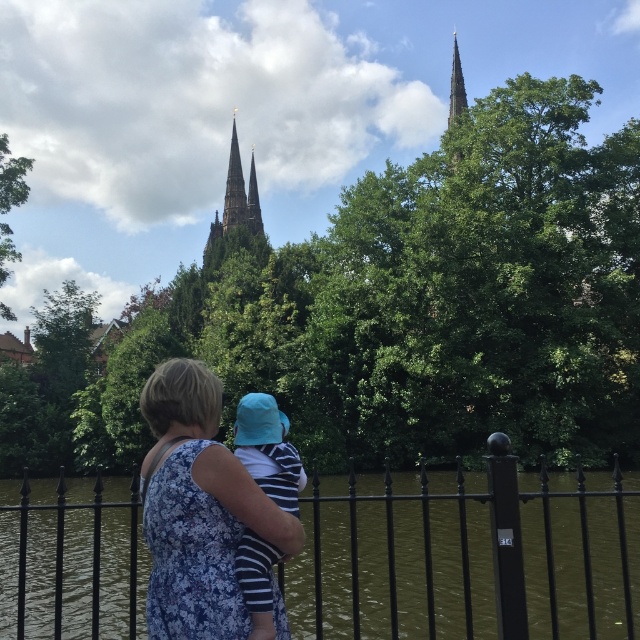
Based on the photo, you are a photographer trying to capture a photo of both the black wrought iron fence at center and the floral dress at center in the same frame. Based on the scene description, can you determine if they are close enough to be captured in a single photo without moving the camera?

The black wrought iron fence at center and floral dress at center are 15.06 meters apart from each other. Depending on the camera lens used, this distance may require a wide angle or zoom lens to capture both in the same frame without moving the camera.

You are a photographer trying to capture a photo of the smooth stone spire at upper center and the blue fabric hat at center. Since you want to ensure both are clearly visible in the frame, which object should you focus on first considering their sizes?

The blue fabric hat at center has a lesser width compared to the smooth stone spire at upper center, so you should focus on the smooth stone spire at upper center first because it is larger and might require more precise focusing to capture details.

You are a tourist standing in front of the dark gray stone tower at upper center and the smooth stone spire at center. Which structure would cast a longer shadow during midday? Please explain your reasoning based on their sizes.

The dark gray stone tower at upper center is larger in size than the smooth stone spire at center. Since larger structures generally cast longer shadows, the dark gray stone tower at upper center would cast a longer shadow during midday.